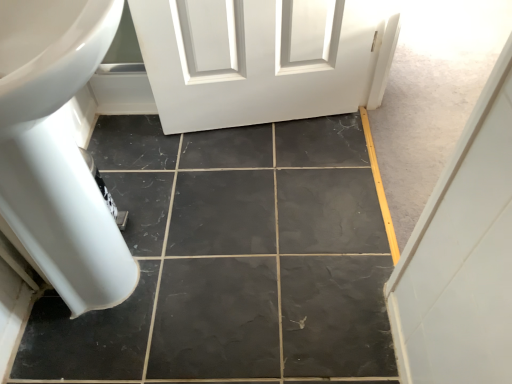
I want to click on vacant space underneath white glossy bath at left (from a real-world perspective), so click(x=133, y=284).